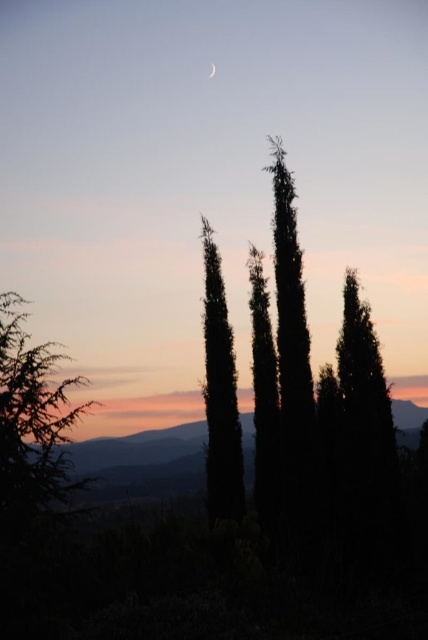
Question: Where is silhouette coniferous tree at center located in relation to silvery reflective crescent at upper center in the image?

Choices:
 (A) below
 (B) above

Answer: (A)

Question: Based on their relative distances, which object is nearer to the green leafy tree at left?

Choices:
 (A) silhouette coniferous tree at center
 (B) silvery reflective crescent at upper center

Answer: (A)

Question: Is silhouette coniferous tree at center to the left of silvery reflective crescent at upper center from the viewer's perspective?

Choices:
 (A) no
 (B) yes

Answer: (A)

Question: Estimate the real-world distances between objects in this image. Which object is closer to the silhouette coniferous tree at center?

Choices:
 (A) green leafy tree at left
 (B) silvery reflective crescent at upper center

Answer: (A)

Question: Is green leafy tree at left to the left of silhouette coniferous tree at center from the viewer's perspective?

Choices:
 (A) no
 (B) yes

Answer: (B)

Question: Among these objects, which one is nearest to the camera?

Choices:
 (A) green leafy tree at left
 (B) silvery reflective crescent at upper center
 (C) silhouette coniferous tree at center

Answer: (A)